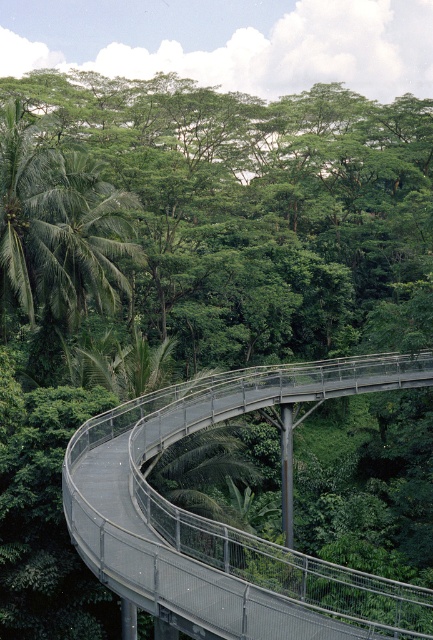
Question: Can you confirm if metallic gray pedestrian bridge at center is smaller than green leafy palm at left?

Choices:
 (A) yes
 (B) no

Answer: (B)

Question: Which object appears farthest from the camera in this image?

Choices:
 (A) metallic gray pedestrian bridge at center
 (B) green leafy palm at left

Answer: (B)

Question: Does metallic gray pedestrian bridge at center come in front of green leafy palm at left?

Choices:
 (A) yes
 (B) no

Answer: (A)

Question: Does metallic gray pedestrian bridge at center appear under green leafy palm at left?

Choices:
 (A) yes
 (B) no

Answer: (A)